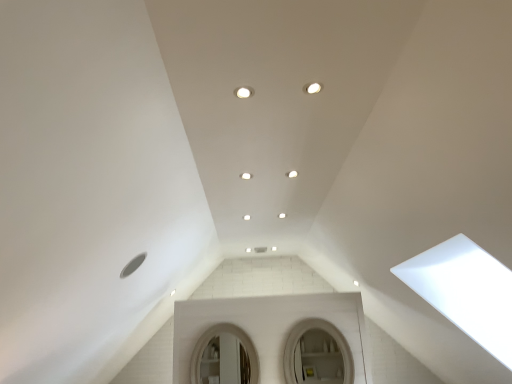
Question: Considering the relative positions of white glossy light fixture at center and white matte mirror at center, which is counted as the first mirror, starting from the left, in the image provided, is white glossy light fixture at center to the right of white matte mirror at center, which is counted as the first mirror, starting from the left, from the viewer's perspective?

Choices:
 (A) yes
 (B) no

Answer: (A)

Question: From the image's perspective, does white glossy light fixture at center appear lower than white matte mirror at center, arranged as the 2th mirror when viewed from the right?

Choices:
 (A) yes
 (B) no

Answer: (B)

Question: Is white matte mirror at center, arranged as the 2th mirror when viewed from the right, surrounded by white glossy light fixture at center?

Choices:
 (A) no
 (B) yes

Answer: (A)

Question: Can you confirm if white glossy light fixture at center is bigger than white matte mirror at center, arranged as the 2th mirror when viewed from the right?

Choices:
 (A) no
 (B) yes

Answer: (A)

Question: Is white glossy light fixture at center shorter than white matte mirror at center, arranged as the 2th mirror when viewed from the right?

Choices:
 (A) yes
 (B) no

Answer: (A)

Question: From a real-world perspective, is white glossy light fixture at center below white matte mirror at center, arranged as the 2th mirror when viewed from the right?

Choices:
 (A) no
 (B) yes

Answer: (A)

Question: From the image's perspective, is white glossy mirror at center, the second mirror in the left-to-right sequence, on top of white glossy light fixture at center?

Choices:
 (A) no
 (B) yes

Answer: (A)

Question: Could you tell me if white glossy mirror at center, positioned as the 1th mirror in right-to-left order, is turned towards white glossy light fixture at center?

Choices:
 (A) no
 (B) yes

Answer: (A)

Question: Is white glossy light fixture at center a part of white glossy mirror at center, positioned as the 1th mirror in right-to-left order?

Choices:
 (A) yes
 (B) no

Answer: (B)

Question: Are white glossy mirror at center, positioned as the 1th mirror in right-to-left order, and white glossy light fixture at center making contact?

Choices:
 (A) no
 (B) yes

Answer: (A)

Question: Is white glossy mirror at center, positioned as the 1th mirror in right-to-left order, further to camera compared to white glossy light fixture at center?

Choices:
 (A) no
 (B) yes

Answer: (B)

Question: From the image's perspective, is white glossy mirror at center, positioned as the 1th mirror in right-to-left order, under white glossy light fixture at center?

Choices:
 (A) no
 (B) yes

Answer: (B)

Question: Is white glossy mirror at center, positioned as the 1th mirror in right-to-left order, positioned before white matte mirror at center, which is counted as the first mirror, starting from the left?

Choices:
 (A) yes
 (B) no

Answer: (A)